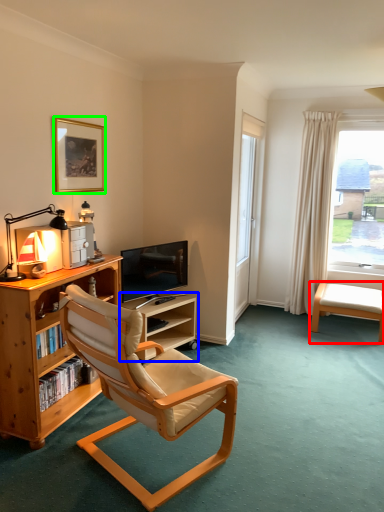
Question: Estimate the real-world distances between objects in this image. Which object is farther from swivel chair (highlighted by a red box), shelf (highlighted by a blue box) or picture frame (highlighted by a green box)?

Choices:
 (A) shelf
 (B) picture frame

Answer: (B)